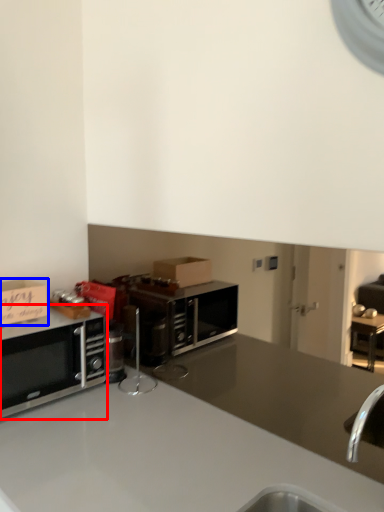
Question: Among these objects, which one is nearest to the camera, microwave oven (highlighted by a red box) or cabinetry (highlighted by a blue box)?

Choices:
 (A) microwave oven
 (B) cabinetry

Answer: (A)